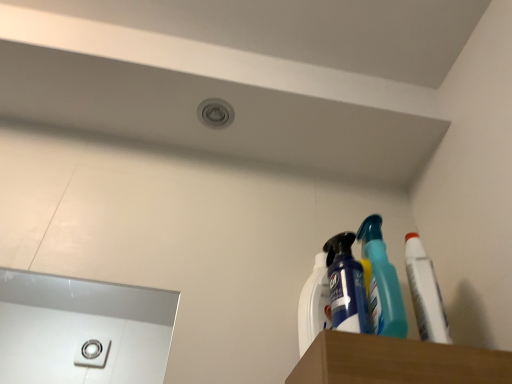
Question: Would you say blue glossy spray bottle at upper right, the 2th cleaning product viewed from the left, contains white plastic spray bottle at upper right, which appears as the 2th cleaning product when viewed from the right?

Choices:
 (A) no
 (B) yes

Answer: (A)

Question: Can you confirm if blue glossy spray bottle at upper right, arranged as the first cleaning product when viewed from the right, is thinner than white plastic spray bottle at upper right, which appears as the 2th cleaning product when viewed from the right?

Choices:
 (A) no
 (B) yes

Answer: (A)

Question: From the image's perspective, does blue glossy spray bottle at upper right, arranged as the first cleaning product when viewed from the right, appear higher than white plastic spray bottle at upper right, which appears as the 2th cleaning product when viewed from the right?

Choices:
 (A) yes
 (B) no

Answer: (A)

Question: Could you tell me if blue glossy spray bottle at upper right, arranged as the first cleaning product when viewed from the right, is facing white plastic spray bottle at upper right, which appears as the 2th cleaning product when viewed from the right?

Choices:
 (A) yes
 (B) no

Answer: (B)

Question: Can you confirm if blue glossy spray bottle at upper right, the 2th cleaning product viewed from the left, is wider than white plastic spray bottle at upper right, which appears as the 2th cleaning product when viewed from the right?

Choices:
 (A) no
 (B) yes

Answer: (B)

Question: Can you confirm if blue glossy spray bottle at upper right, the 2th cleaning product viewed from the left, is shorter than white plastic spray bottle at upper right, which appears as the 2th cleaning product when viewed from the right?

Choices:
 (A) no
 (B) yes

Answer: (B)

Question: Does white plastic spray bottle at upper right, which appears as the 2th cleaning product when viewed from the right, appear on the left side of blue glossy spray bottle at upper right, arranged as the first cleaning product when viewed from the right?

Choices:
 (A) no
 (B) yes

Answer: (B)

Question: Are white plastic spray bottle at upper right, which is the first cleaning product from left to right, and blue glossy spray bottle at upper right, arranged as the first cleaning product when viewed from the right, located far from each other?

Choices:
 (A) no
 (B) yes

Answer: (A)

Question: Is white plastic spray bottle at upper right, which is the first cleaning product from left to right, thinner than blue glossy spray bottle at upper right, arranged as the first cleaning product when viewed from the right?

Choices:
 (A) no
 (B) yes

Answer: (B)

Question: From the image's perspective, is white plastic spray bottle at upper right, which is the first cleaning product from left to right, under blue glossy spray bottle at upper right, arranged as the first cleaning product when viewed from the right?

Choices:
 (A) no
 (B) yes

Answer: (B)

Question: Is blue glossy spray bottle at upper right, the 2th cleaning product viewed from the left, at the back of white plastic spray bottle at upper right, which appears as the 2th cleaning product when viewed from the right?

Choices:
 (A) no
 (B) yes

Answer: (A)

Question: Does white plastic spray bottle at upper right, which is the first cleaning product from left to right, have a smaller size compared to blue glossy spray bottle at upper right, the 2th cleaning product viewed from the left?

Choices:
 (A) yes
 (B) no

Answer: (A)

Question: From the image's perspective, is blue glossy spray bottle at upper right, arranged as the first cleaning product when viewed from the right, on white matte toothpaste at right?

Choices:
 (A) yes
 (B) no

Answer: (A)